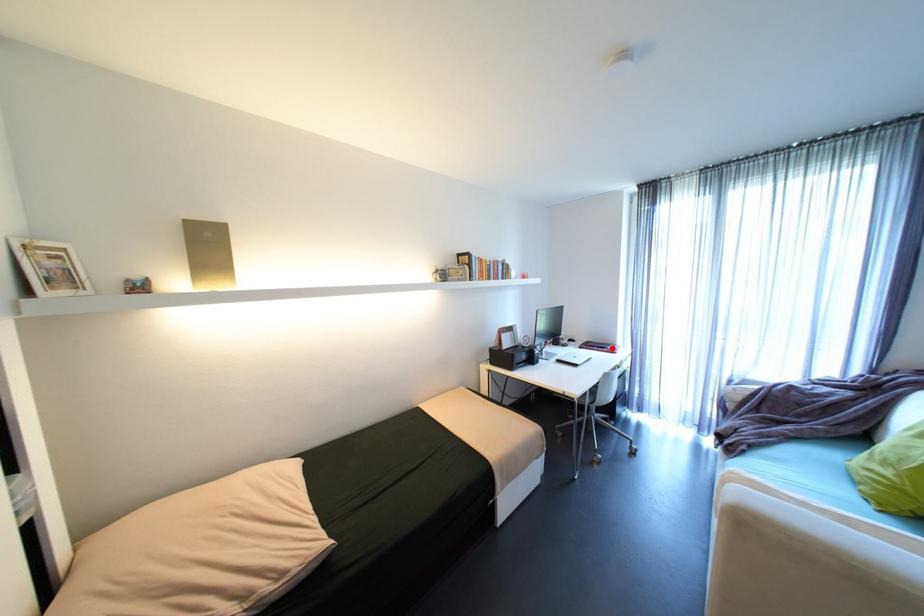
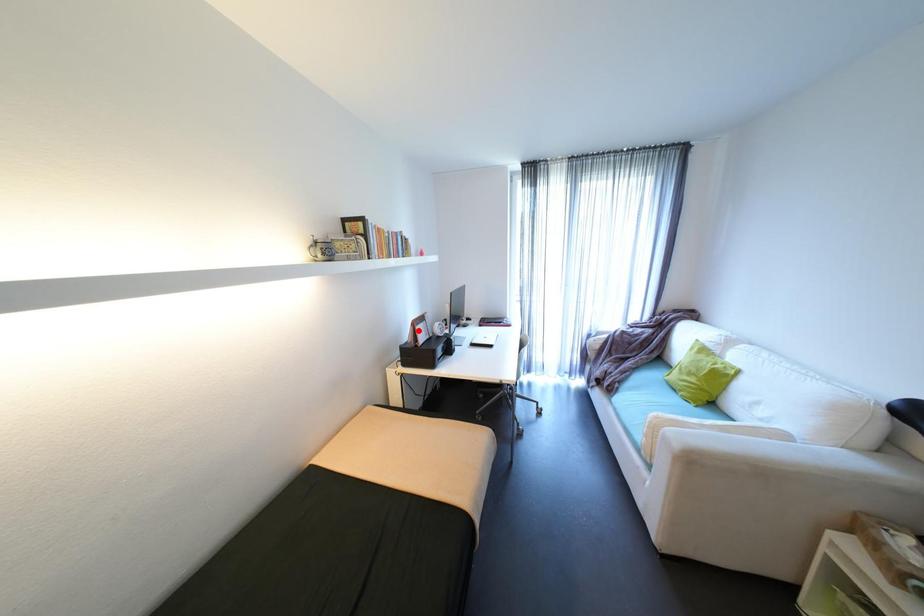
I am providing you with two images of the same scene from different viewpoints. A red point is marked on the first image and another point is marked on the second image. Is the red point in image1 aligned with the point shown in image2?

No